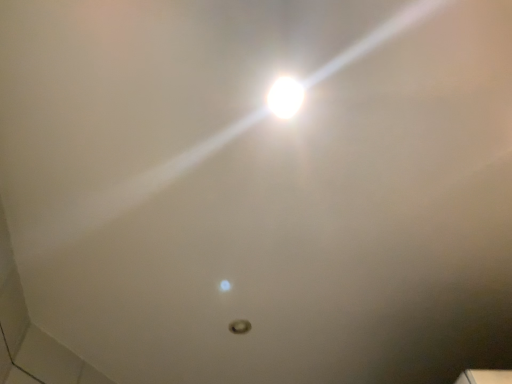
Where is `white glossy light bulb at upper center`? The height and width of the screenshot is (384, 512). white glossy light bulb at upper center is located at coordinates (285, 97).

What is the approximate height of white glossy light bulb at upper center?

white glossy light bulb at upper center is 0.39 inches tall.

What do you see at coordinates (285, 97) in the screenshot?
I see `white glossy light bulb at upper center` at bounding box center [285, 97].

The height and width of the screenshot is (384, 512). Find the location of `white glossy light bulb at upper center`. white glossy light bulb at upper center is located at coordinates (285, 97).